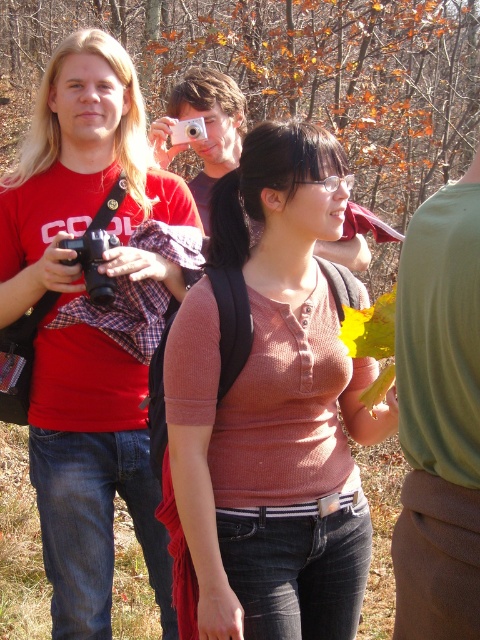
You are a photographer who needs to place a 3.5 feet wide tripod between the black plastic camera at left and the silver metallic camera at center. Is there enough space to fit the tripod between them?

The distance between the black plastic camera at left and the silver metallic camera at center is 5.07 feet. Since the tripod requires 3.5 feet of space, there is sufficient room to place it between them.

You are a photographer trying to capture a photo of the green fabric shirt at upper center and the silver metallic camera at center. Based on their positions, which object should you focus on first to ensure both are in frame?

The green fabric shirt at upper center is below the silver metallic camera at center, so you should focus on the silver metallic camera at center first to ensure both are in frame.